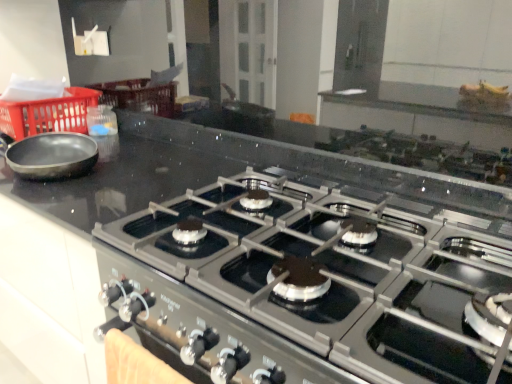
Question: Is red plastic basket at left bigger or smaller than black stainless steel gas stove at center?

Choices:
 (A) small
 (B) big

Answer: (A)

Question: From the image's perspective, is red plastic basket at left positioned above or below black stainless steel gas stove at center?

Choices:
 (A) below
 (B) above

Answer: (B)

Question: In the image, is red plastic basket at left on the left side or the right side of black stainless steel gas stove at center?

Choices:
 (A) left
 (B) right

Answer: (A)

Question: In terms of height, does black stainless steel gas stove at center look taller or shorter compared to red plastic basket at left?

Choices:
 (A) tall
 (B) short

Answer: (A)

Question: Relative to red plastic basket at left, is black stainless steel gas stove at center in front or behind?

Choices:
 (A) behind
 (B) front

Answer: (B)

Question: From the image's perspective, is black stainless steel gas stove at center above or below red plastic basket at left?

Choices:
 (A) below
 (B) above

Answer: (A)

Question: Looking at their shapes, would you say black stainless steel gas stove at center is wider or thinner than red plastic basket at left?

Choices:
 (A) wide
 (B) thin

Answer: (A)